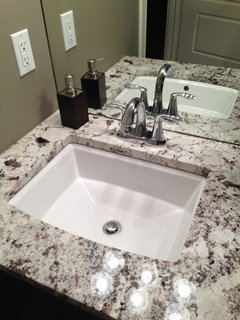
The height and width of the screenshot is (320, 240). Find the location of `marble counter`. marble counter is located at coordinates tap(217, 255).